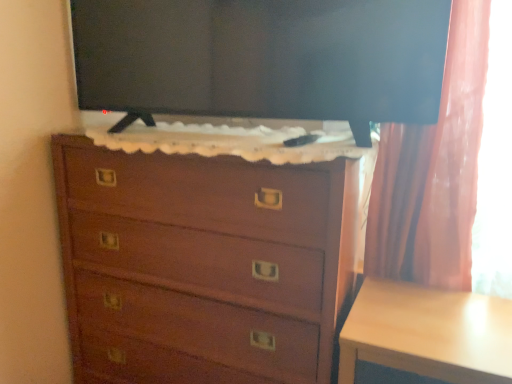
Identify the location of black glossy tv at upper center. This screenshot has width=512, height=384. click(263, 59).

This screenshot has width=512, height=384. What do you see at coordinates (263, 59) in the screenshot? I see `black glossy tv at upper center` at bounding box center [263, 59].

Locate an element on the screen. light wood table at lower right is located at coordinates coord(428,333).

Where is `black glossy tv at upper center`? The width and height of the screenshot is (512, 384). black glossy tv at upper center is located at coordinates (263, 59).

Between black glossy tv at upper center and light wood table at lower right, which one has more height?

light wood table at lower right.

Considering the relative positions of black glossy tv at upper center and light wood table at lower right in the image provided, is black glossy tv at upper center to the left of light wood table at lower right from the viewer's perspective?

Correct, you'll find black glossy tv at upper center to the left of light wood table at lower right.

Is black glossy tv at upper center next to light wood table at lower right and touching it?

No, black glossy tv at upper center is not with light wood table at lower right.

I want to click on tv show behind the wooden chest of drawers at center, so click(x=263, y=59).

Is black glossy tv at upper center behind wooden chest of drawers at center?

Yes, black glossy tv at upper center is further from the viewer.

Is black glossy tv at upper center aimed at wooden chest of drawers at center?

No, black glossy tv at upper center is not oriented towards wooden chest of drawers at center.

From the picture: Is black glossy tv at upper center not near wooden chest of drawers at center?

No, black glossy tv at upper center is in close proximity to wooden chest of drawers at center.

From the image's perspective, is wooden chest of drawers at center positioned above or below light wood table at lower right?

Based on their image positions, wooden chest of drawers at center is located above light wood table at lower right.

From a real-world perspective, is wooden chest of drawers at center positioned under light wood table at lower right based on gravity?

No.

How many degrees apart are the facing directions of wooden chest of drawers at center and light wood table at lower right?

They differ by 3.62 degrees in their facing directions.

Is wooden chest of drawers at center turned away from black glossy tv at upper center?

wooden chest of drawers at center does not have its back to black glossy tv at upper center.

From the image's perspective, is wooden chest of drawers at center below black glossy tv at upper center?

Yes, from the image's perspective, wooden chest of drawers at center is beneath black glossy tv at upper center.

From a real-world perspective, which is physically above, wooden chest of drawers at center or black glossy tv at upper center?

black glossy tv at upper center, from a real-world perspective.

Which is more to the right, light wood table at lower right or black glossy tv at upper center?

light wood table at lower right is more to the right.

Which is behind, light wood table at lower right or black glossy tv at upper center?

black glossy tv at upper center is behind.

Is light wood table at lower right oriented towards black glossy tv at upper center?

No, light wood table at lower right is not oriented towards black glossy tv at upper center.

From a real-world perspective, which is physically above, light wood table at lower right or wooden chest of drawers at center?

From a 3D spatial view, wooden chest of drawers at center is above.

Considering the relative positions of light wood table at lower right and wooden chest of drawers at center in the image provided, is light wood table at lower right to the left of wooden chest of drawers at center from the viewer's perspective?

No.

Is point (447, 308) farther from camera compared to point (172, 354)?

No, it is not.

At what (x,y) coordinates should I click in order to perform the action: click on tv show that appears behind the light wood table at lower right. Please return your answer as a coordinate pair (x, y). Looking at the image, I should click on (x=263, y=59).

Where is `chest of drawers below the black glossy tv at upper center (from a real-world perspective)`? Image resolution: width=512 pixels, height=384 pixels. chest of drawers below the black glossy tv at upper center (from a real-world perspective) is located at coordinates (203, 265).

When comparing their distances from wooden chest of drawers at center, does black glossy tv at upper center or light wood table at lower right seem closer?

Among the two, light wood table at lower right is located nearer to wooden chest of drawers at center.

When comparing their distances from light wood table at lower right, does black glossy tv at upper center or wooden chest of drawers at center seem closer?

wooden chest of drawers at center is closer to light wood table at lower right.

In the scene shown: Based on their spatial positions, is light wood table at lower right or wooden chest of drawers at center further from black glossy tv at upper center?

Based on the image, light wood table at lower right appears to be further to black glossy tv at upper center.

Considering their positions, is light wood table at lower right positioned closer to wooden chest of drawers at center than black glossy tv at upper center?

light wood table at lower right is closer to wooden chest of drawers at center.

Based on their spatial positions, is wooden chest of drawers at center or light wood table at lower right closer to black glossy tv at upper center?

Based on the image, wooden chest of drawers at center appears to be nearer to black glossy tv at upper center.

Estimate the real-world distances between objects in this image. Which object is closer to light wood table at lower right, wooden chest of drawers at center or black glossy tv at upper center?

Based on the image, wooden chest of drawers at center appears to be nearer to light wood table at lower right.

At what (x,y) coordinates should I click in order to perform the action: click on the chest of drawers that lies between black glossy tv at upper center and light wood table at lower right from top to bottom. Please return your answer as a coordinate pair (x, y). Looking at the image, I should click on (203, 265).